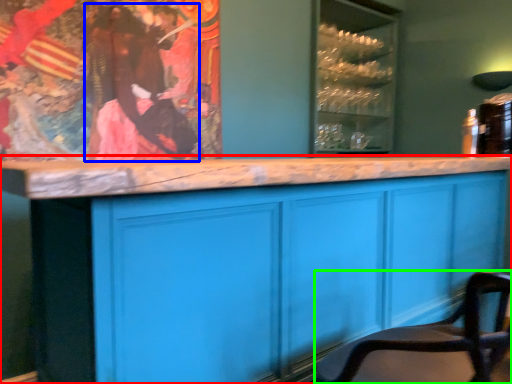
Question: Based on their relative distances, which object is nearer to cabinetry (highlighted by a red box)? Choose from person (highlighted by a blue box) and chair (highlighted by a green box).

Choices:
 (A) person
 (B) chair

Answer: (B)